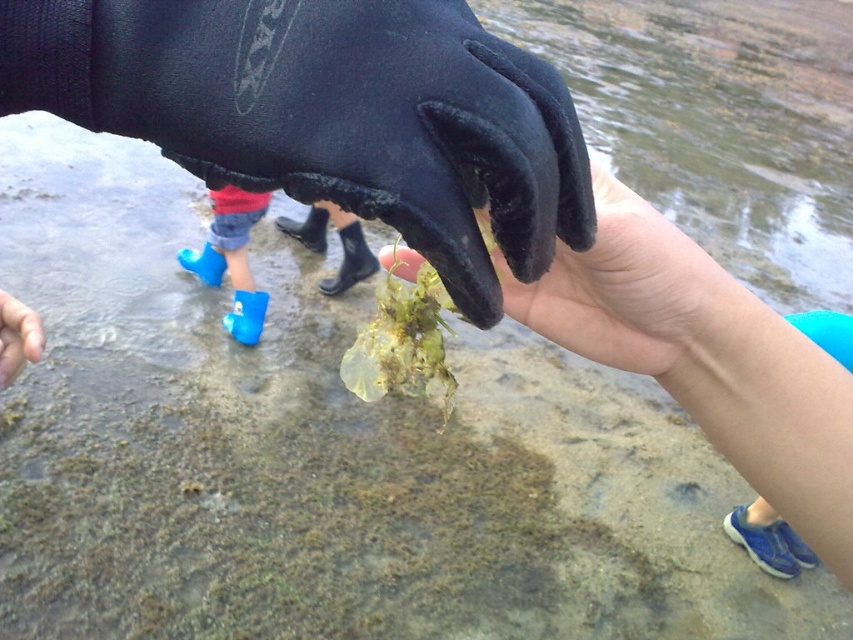
Question: From the image, what is the correct spatial relationship of smooth skin hand at lower left in relation to blue rubber boot at lower left?

Choices:
 (A) right
 (B) left

Answer: (A)

Question: Which of these objects is positioned farthest from the matte black glove at center?

Choices:
 (A) black neoprene glove at center
 (B) yellowish-green leafy plant at center
 (C) smooth skin hand at lower left
 (D) blue rubber boot at lower left

Answer: (D)

Question: Which object is closer to the camera taking this photo?

Choices:
 (A) yellowish-green leafy plant at center
 (B) black neoprene glove at center

Answer: (B)

Question: Which object is the closest to the matte black glove at center?

Choices:
 (A) smooth skin hand at lower left
 (B) black neoprene glove at center

Answer: (B)

Question: Can you confirm if black neoprene glove at center is wider than matte black glove at center?

Choices:
 (A) yes
 (B) no

Answer: (B)

Question: From the image, what is the correct spatial relationship of black neoprene glove at center in relation to smooth skin hand at lower left?

Choices:
 (A) right
 (B) left

Answer: (A)